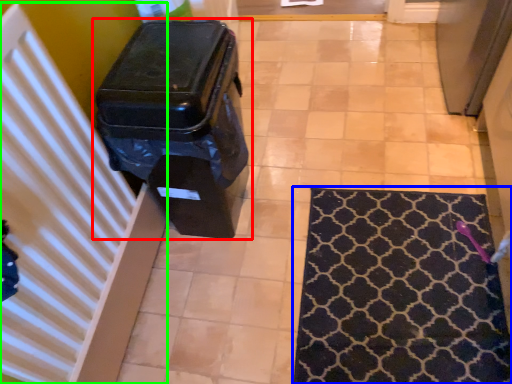
Question: Which is farther away from waste container (highlighted by a red box)? mat (highlighted by a blue box) or radiator (highlighted by a green box)?

Choices:
 (A) mat
 (B) radiator

Answer: (A)